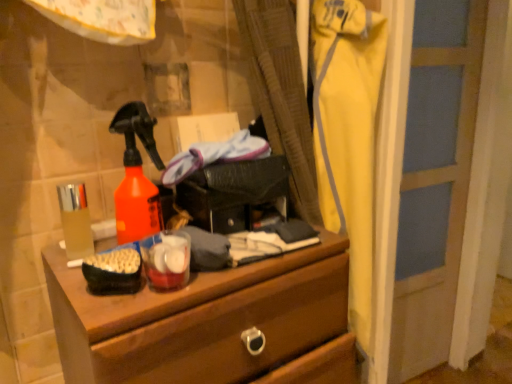
I want to click on free point above wooden chest of drawers at center (from a real-world perspective), so click(x=233, y=265).